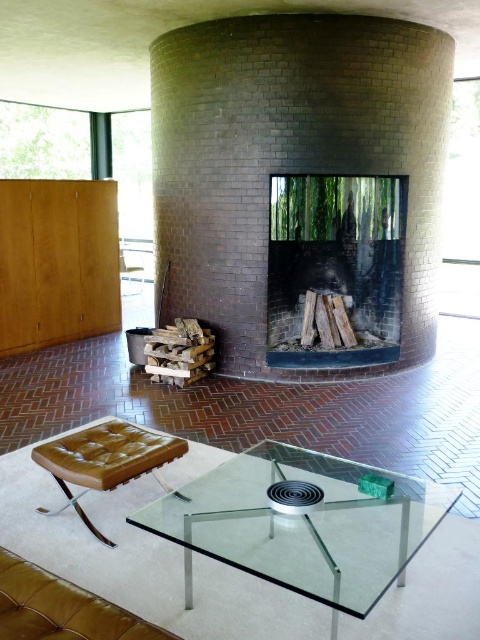
You are a guest entering the room and want to place a tall potted plant on the transparent glass table at center. Considering the height of the black brick fireplace at center, will the plant be visible over the fireplace when viewed from the entrance?

The transparent glass table at center is shorter than the black brick fireplace at center. Since the table is shorter, the tall potted plant placed on it would be partially obscured by the fireplace when viewed from the entrance.

You are standing in the room and want to place a decorative vase on the transparent glass table at center. According to the image, where exactly should you place the vase in terms of coordinates?

The transparent glass table at center is located at coordinates point (302,525), so you should place the vase there.

You are planning to place a rectangular plant pot that is 1.2 meters wide on the transparent glass table at center and brown leather ottoman at center. Which object can accommodate the plant pot based on their widths?

The transparent glass table at center has a greater width than the brown leather ottoman at center, so the plant pot can be placed on the transparent glass table at center.